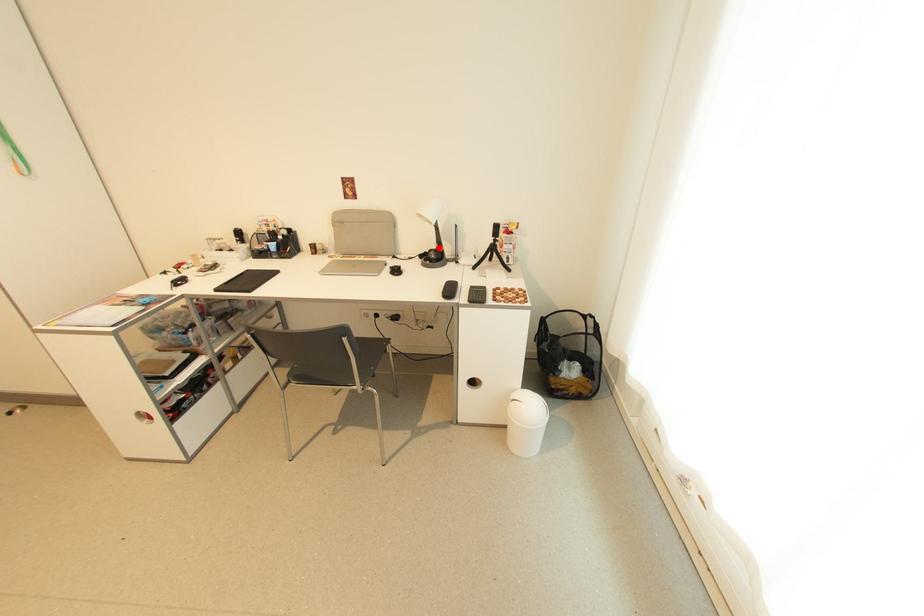
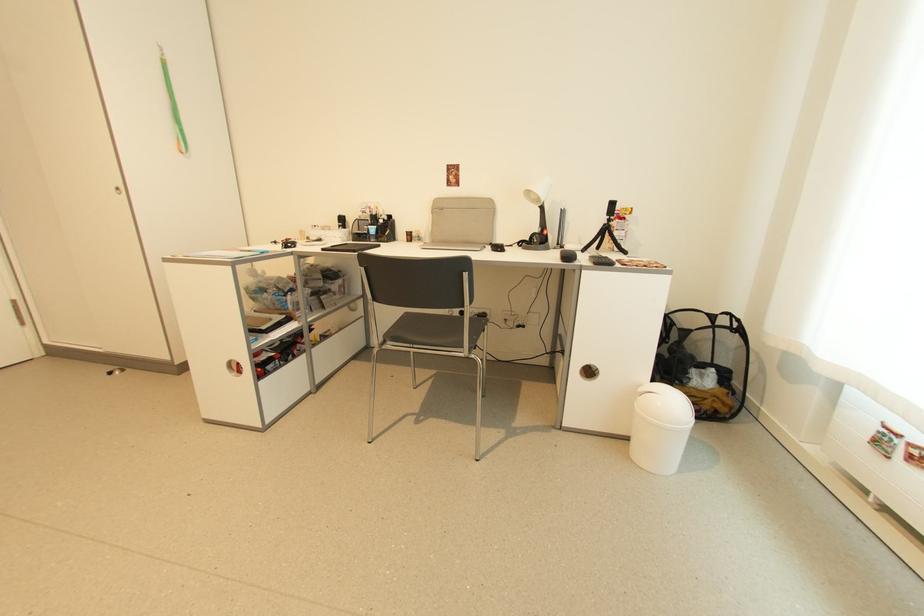
The point at the highlighted location is marked in the first image. Where is the corresponding point in the second image?

(541, 232)